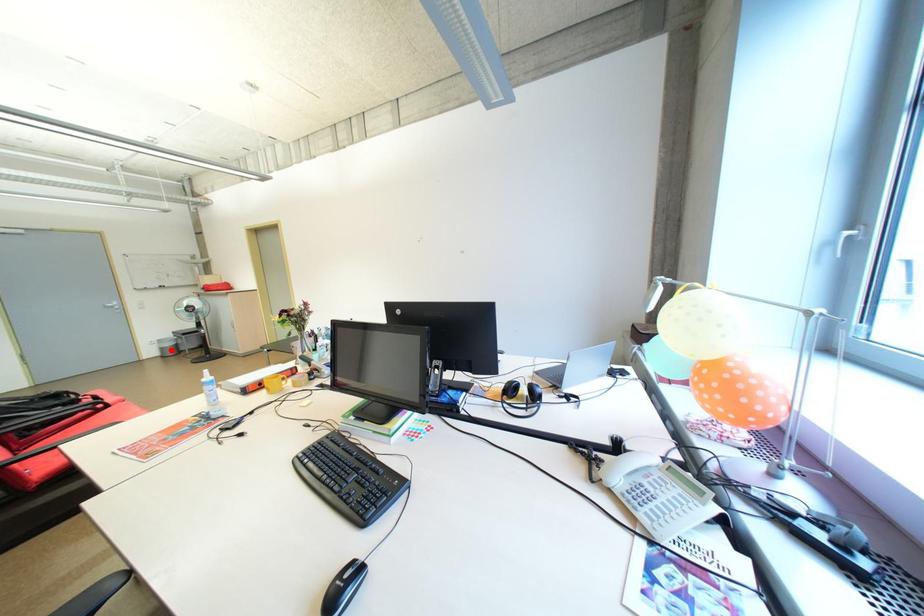
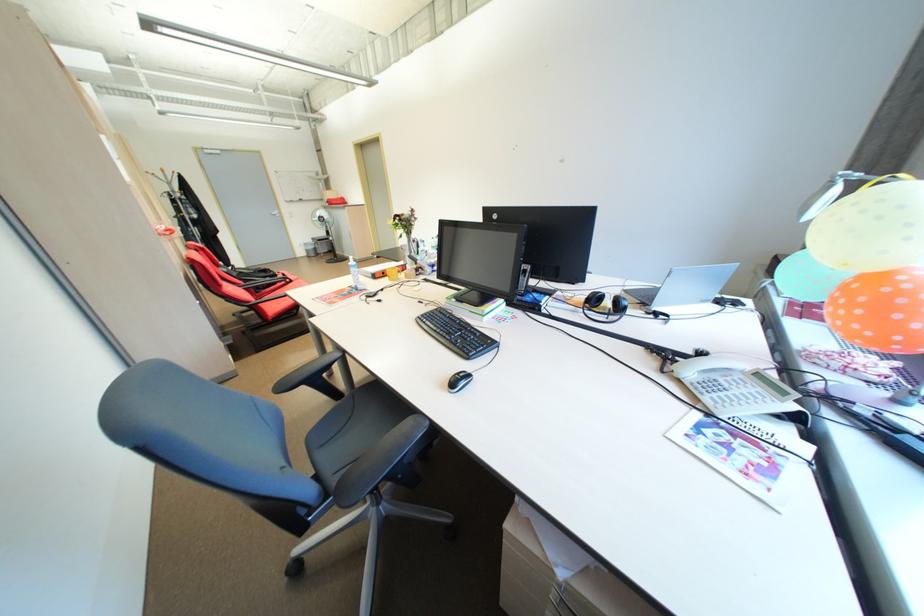
Locate, in the second image, the point that corresponds to the highlighted location in the first image.

(315, 252)